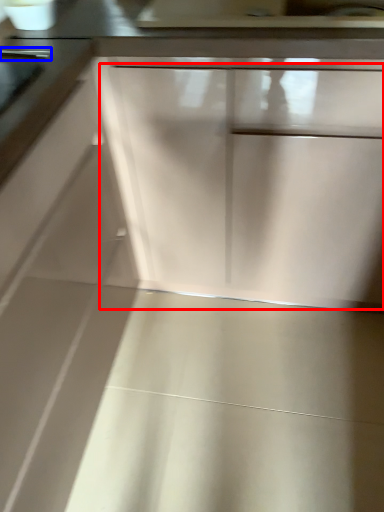
Question: Which point is further to the camera, drawer (highlighted by a red box) or door handle (highlighted by a blue box)?

Choices:
 (A) drawer
 (B) door handle

Answer: (B)